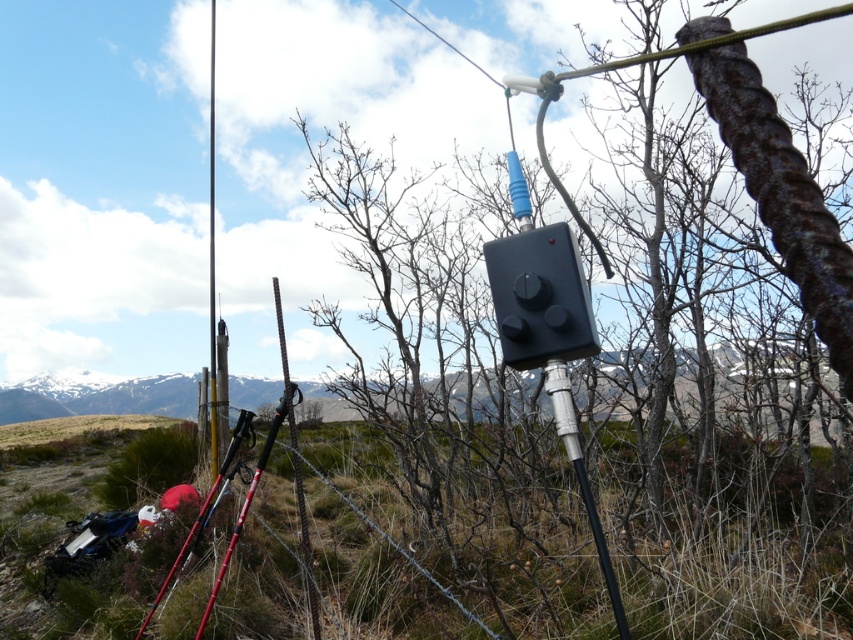
You are a hiker who has just arrived at this remote area. You notice two poles at the center of your view. Which one is higher up in the air between the silver metallic ski pole at center and the smooth black pole at center?

The silver metallic ski pole at center is located above the smooth black pole at center, so it is higher up in the air.

In the scene shown: You are standing at the point with coordinates point [642,186]. What object are you directly facing?

The point [642,186] corresponds to the rusty metal pole at center, so you are directly facing the rusty metal pole at center.